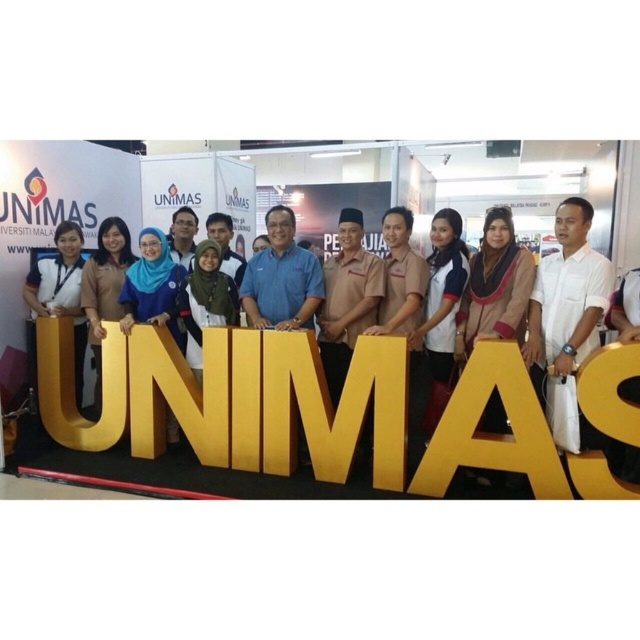
Which is below, matte gold letter at center or matte black shirt at left?

Positioned lower is matte gold letter at center.

Between matte gold letter at center and matte black shirt at left, which one has more height?

matte black shirt at left

At what (x,y) coordinates should I click in order to perform the action: click on matte gold letter at center. Please return your answer as a coordinate pair (x, y). The height and width of the screenshot is (640, 640). Looking at the image, I should click on (260, 401).

Does white cotton shirt at center appear over matte black shirt at left?

Actually, white cotton shirt at center is below matte black shirt at left.

Consider the image. Does white cotton shirt at center appear under matte black shirt at left?

Yes, white cotton shirt at center is below matte black shirt at left.

Identify the location of white cotton shirt at center. The width and height of the screenshot is (640, 640). (566, 316).

At what (x,y) coordinates should I click in order to perform the action: click on white cotton shirt at center. Please return your answer as a coordinate pair (x, y). This screenshot has height=640, width=640. Looking at the image, I should click on (566, 316).

Is point (310, 362) positioned behind point (566, 284)?

Yes, point (310, 362) is behind point (566, 284).

Based on the photo, between matte gold letter at center and white cotton shirt at center, which one has more height?

white cotton shirt at center

Which is behind, point (140, 356) or point (541, 355)?

Positioned behind is point (140, 356).

This screenshot has width=640, height=640. What are the coordinates of `matte gold letter at center` in the screenshot? It's located at (260, 401).